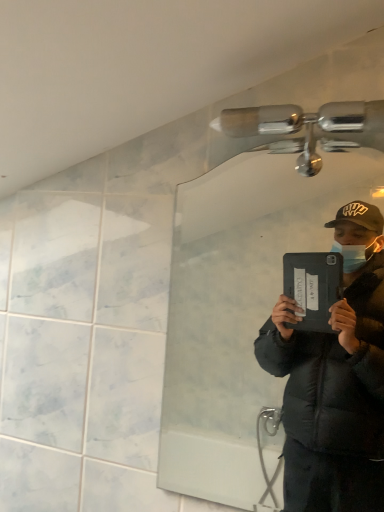
I want to click on clear glass mirror at upper center, so point(249,284).

The width and height of the screenshot is (384, 512). What do you see at coordinates (249, 284) in the screenshot?
I see `clear glass mirror at upper center` at bounding box center [249, 284].

At what (x,y) coordinates should I click in order to perform the action: click on clear glass mirror at upper center. Please return your answer as a coordinate pair (x, y). Looking at the image, I should click on (249, 284).